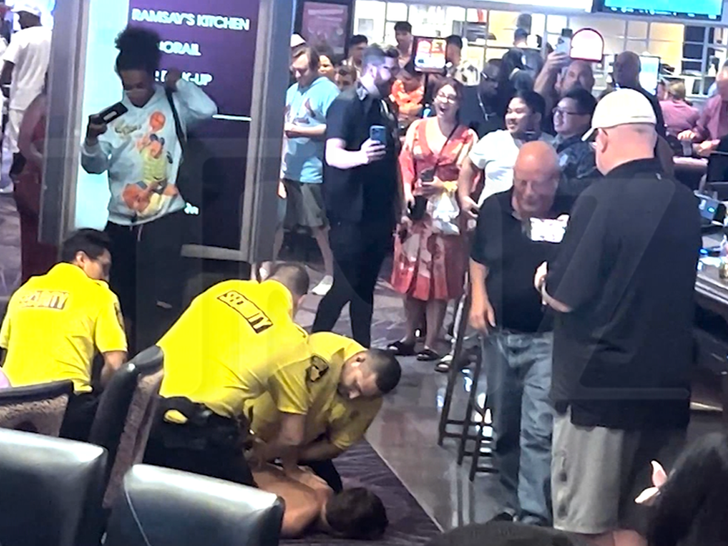
This screenshot has width=728, height=546. I want to click on counter, so click(707, 270).